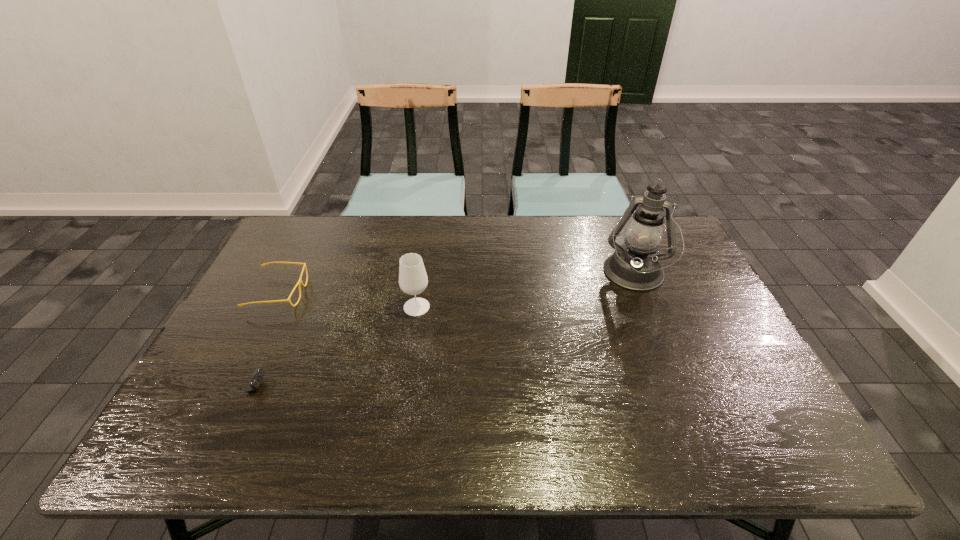
In order to click on the rightmost object in this screenshot , I will do `click(636, 266)`.

This screenshot has height=540, width=960. Identify the location of oil lamp. (636, 266).

Find the location of `glass`. glass is located at coordinates (413, 280).

At what (x,y) coordinates should I click in order to perform the action: click on the second tallest object. Please return your answer as a coordinate pair (x, y). The image size is (960, 540). Looking at the image, I should click on (413, 280).

What are the coordinates of `the third tallest object` in the screenshot? It's located at (299, 282).

Where is `webcam`? webcam is located at coordinates (256, 379).

Locate an element on the screen. The image size is (960, 540). the nearest object is located at coordinates (256, 379).

Identify the location of free space located 0.070m on the back of the oil lamp. Image resolution: width=960 pixels, height=540 pixels. point(619,241).

This screenshot has width=960, height=540. I want to click on free space located 0.360m on the left of the second object from right to left, so click(276, 307).

Locate an element on the screen. free space located 0.260m in front of the lenses of the third tallest object is located at coordinates (393, 293).